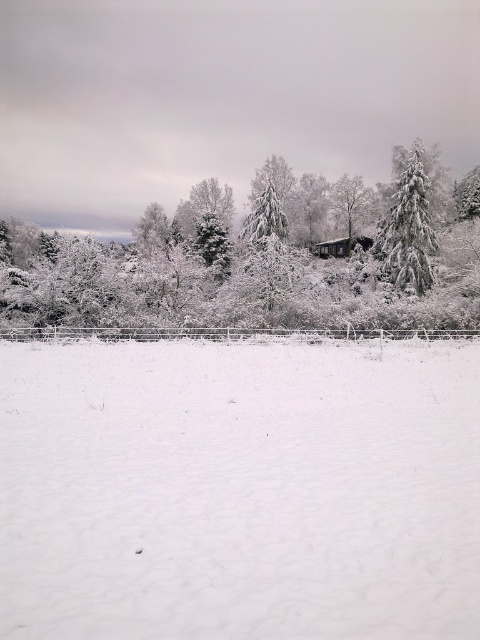
You are an observer standing in the middle of the snowy field. You see the white fluffy snow at center and the white frosty tree at upper center. Which object is taller?

The white frosty tree at upper center is taller than the white fluffy snow at center.